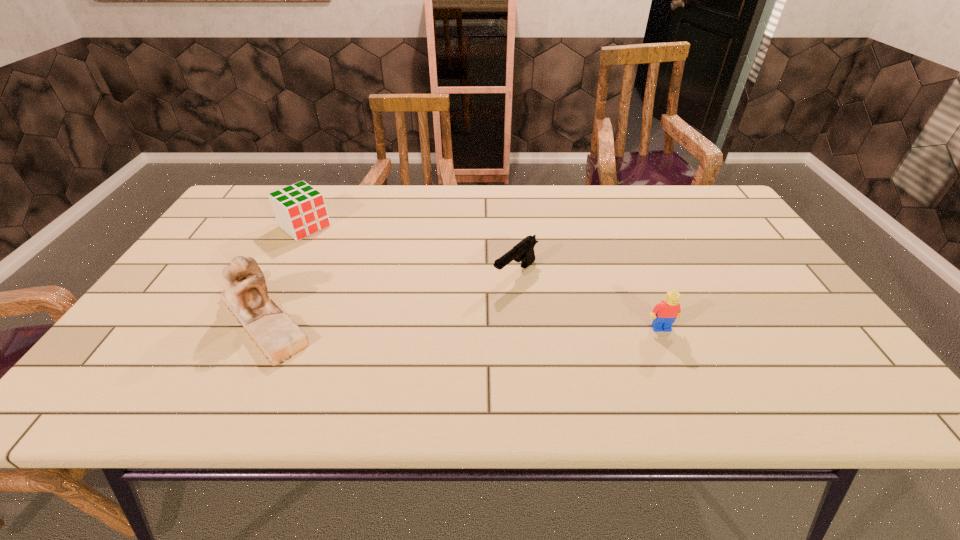
Image resolution: width=960 pixels, height=540 pixels. I want to click on vacant area at the far right corner, so click(725, 211).

The image size is (960, 540). In order to click on free space between the Lego and the second object from right to left in this screenshot , I will do `click(588, 301)`.

The height and width of the screenshot is (540, 960). I want to click on vacant area that lies between the tallest object and the farthest object, so click(284, 272).

Find the location of a particular element. vacant point located between the pistol and the rightmost object is located at coordinates (588, 301).

Image resolution: width=960 pixels, height=540 pixels. Identify the location of free space between the tallest object and the Lego. (463, 323).

The width and height of the screenshot is (960, 540). Identify the location of vacant area that lies between the farthest object and the shortest object. (410, 250).

I want to click on free spot between the rightmost object and the cube, so click(x=483, y=277).

The width and height of the screenshot is (960, 540). I want to click on vacant area that lies between the cube and the rightmost object, so click(483, 277).

Where is `vacant region between the third object from left to right and the Lego`? vacant region between the third object from left to right and the Lego is located at coordinates (588, 301).

I want to click on unoccupied area between the pistol and the rightmost object, so click(x=588, y=301).